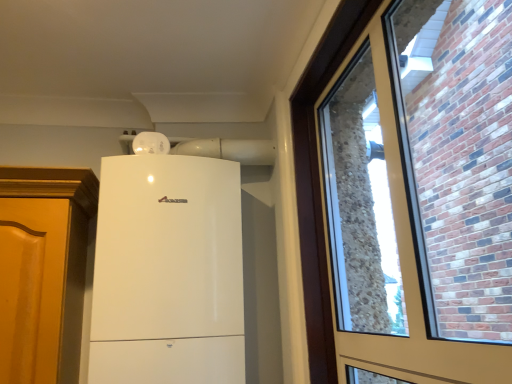
Question: Considering the relative sizes of white glossy refrigerator at upper center and matte glass window at right in the image provided, is white glossy refrigerator at upper center bigger than matte glass window at right?

Choices:
 (A) yes
 (B) no

Answer: (A)

Question: Is white glossy refrigerator at upper center located outside matte glass window at right?

Choices:
 (A) no
 (B) yes

Answer: (B)

Question: Does white glossy refrigerator at upper center have a lesser width compared to matte glass window at right?

Choices:
 (A) yes
 (B) no

Answer: (B)

Question: Considering the relative positions of white glossy refrigerator at upper center and matte glass window at right in the image provided, is white glossy refrigerator at upper center in front of matte glass window at right?

Choices:
 (A) no
 (B) yes

Answer: (A)

Question: Can you confirm if white glossy refrigerator at upper center is smaller than matte glass window at right?

Choices:
 (A) yes
 (B) no

Answer: (B)

Question: From a real-world perspective, is white glossy refrigerator at upper center over matte glass window at right?

Choices:
 (A) no
 (B) yes

Answer: (A)

Question: Is matte glass window at right placed right next to white glossy refrigerator at upper center?

Choices:
 (A) no
 (B) yes

Answer: (A)

Question: Can you confirm if matte glass window at right is bigger than white glossy refrigerator at upper center?

Choices:
 (A) no
 (B) yes

Answer: (A)

Question: From the image's perspective, is matte glass window at right below white glossy refrigerator at upper center?

Choices:
 (A) yes
 (B) no

Answer: (B)

Question: Is the depth of matte glass window at right less than that of white glossy refrigerator at upper center?

Choices:
 (A) yes
 (B) no

Answer: (A)

Question: Would you say matte glass window at right is outside white glossy refrigerator at upper center?

Choices:
 (A) no
 (B) yes

Answer: (B)

Question: Is matte glass window at right smaller than white glossy refrigerator at upper center?

Choices:
 (A) no
 (B) yes

Answer: (B)

Question: Is white glossy refrigerator at upper center bigger or smaller than matte glass window at right?

Choices:
 (A) small
 (B) big

Answer: (B)